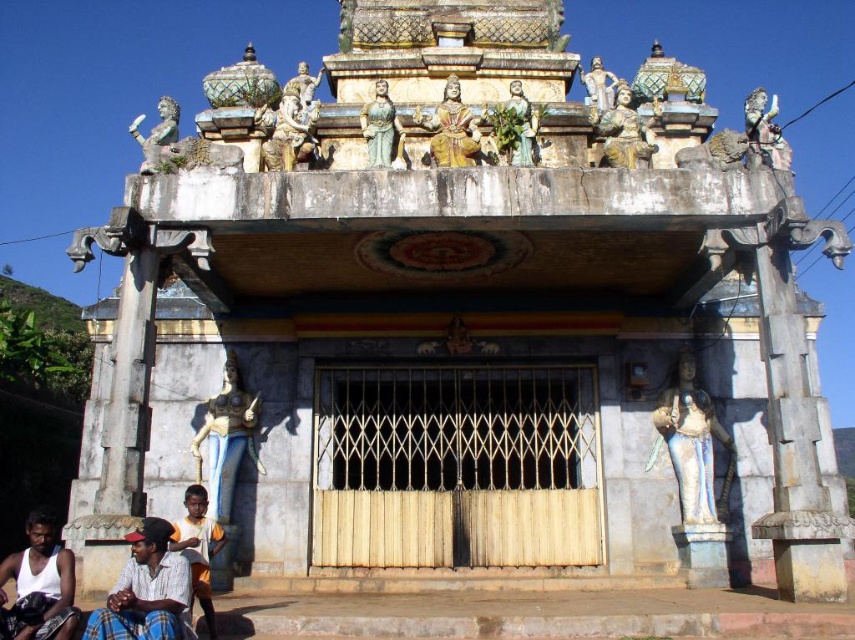
Question: Estimate the real-world distances between objects in this image. Which object is closer to the gold painted statue at center?

Choices:
 (A) wooden gate at center
 (B) yellow striped shirt at lower left
 (C) bronze statue at center

Answer: (C)

Question: Can you confirm if yellow striped shirt at lower left is positioned above gold painted statue at upper center?

Choices:
 (A) no
 (B) yes

Answer: (A)

Question: Among these objects, which one is nearest to the camera?

Choices:
 (A) gold metallic statue at upper right
 (B) white cotton shirt at lower left

Answer: (B)

Question: Does striped fabric shirt at lower left come behind blue stone statue at lower left?

Choices:
 (A) no
 (B) yes

Answer: (A)

Question: Which point is farther from the camera taking this photo?

Choices:
 (A) (634, 115)
 (B) (175, 113)
 (C) (345, 435)
 (D) (599, 68)

Answer: (D)

Question: Is wooden gate at center to the right of white marble statue at right from the viewer's perspective?

Choices:
 (A) no
 (B) yes

Answer: (A)